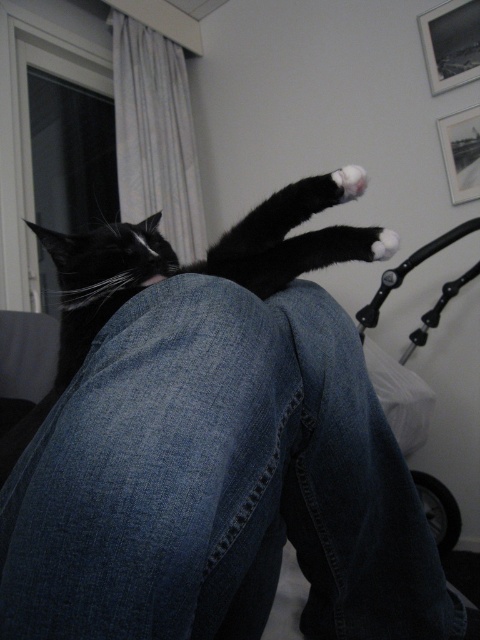
How far apart are black matte fur at center and white matte paw at upper center?

They are 12.41 inches apart.

Can you confirm if black matte fur at center is wider than white matte paw at upper center?

Yes.

Who is more distant from viewer, (290, 211) or (391, 240)?

The point (290, 211) is more distant.

Find the location of `black matte fur at center`. black matte fur at center is located at coordinates (180, 273).

Can you confirm if denim at center is positioned to the right of white matte paw at upper center?

Incorrect, denim at center is not on the right side of white matte paw at upper center.

Which is below, denim at center or white matte paw at upper center?

denim at center is lower down.

The width and height of the screenshot is (480, 640). What are the coordinates of `denim at center` in the screenshot? It's located at (217, 483).

Between denim at center and white fluffy paw at upper center, which one is positioned higher?

white fluffy paw at upper center is above.

Consider the image. Which is below, denim at center or white fluffy paw at upper center?

Positioned lower is denim at center.

Which is behind, point (320, 580) or point (351, 168)?

The point (320, 580) is behind.

The image size is (480, 640). I want to click on denim at center, so click(217, 483).